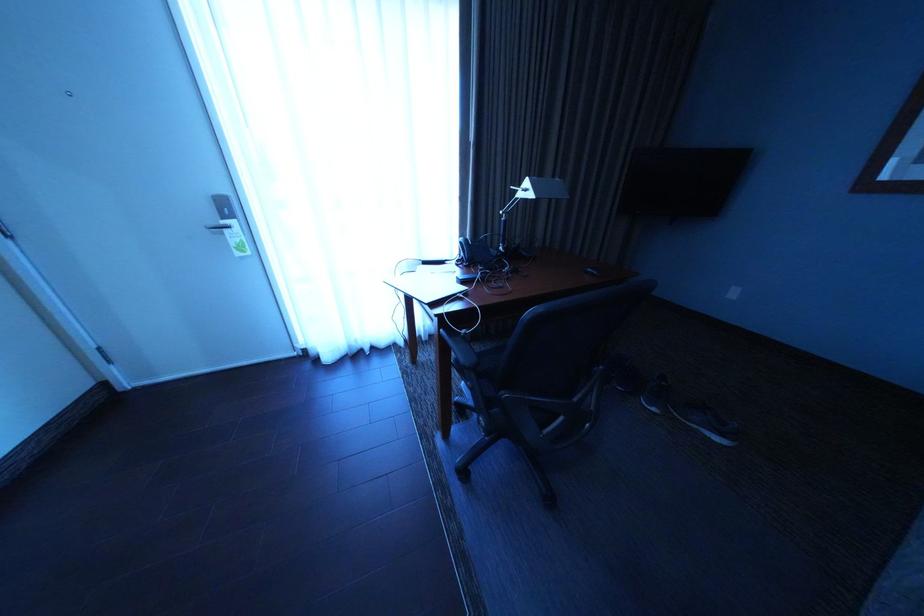
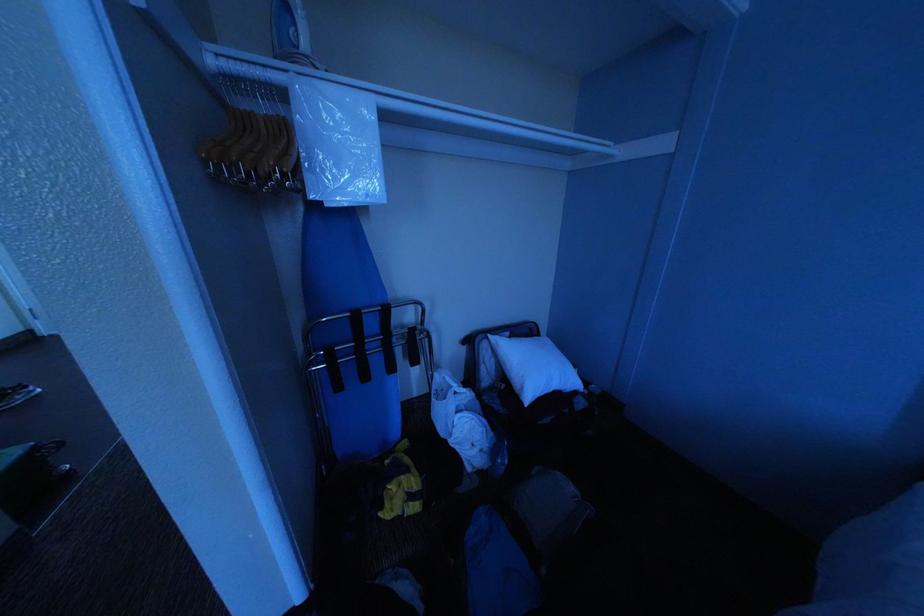
The images are taken continuously from a first-person perspective. In which direction are you moving?

The cameraman walked toward right, backward.